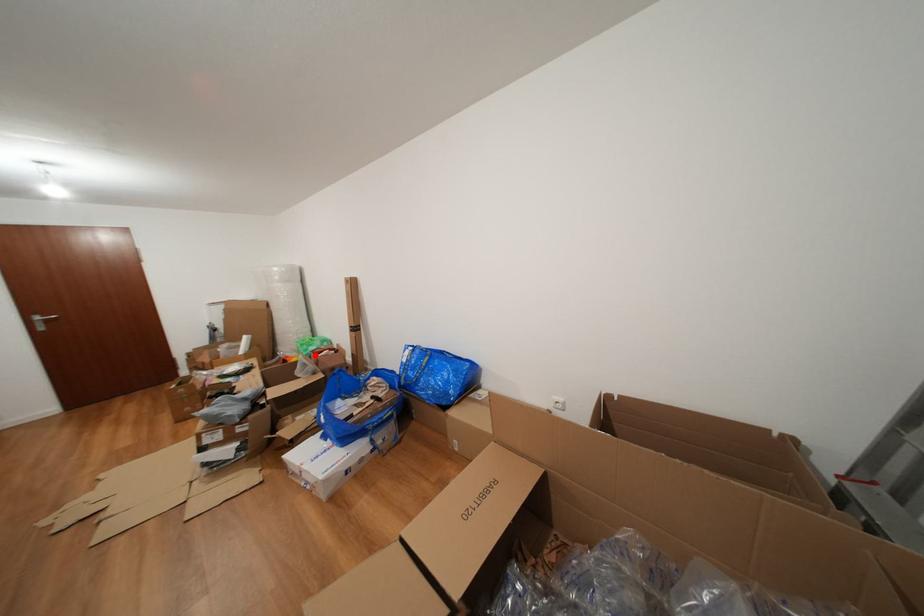
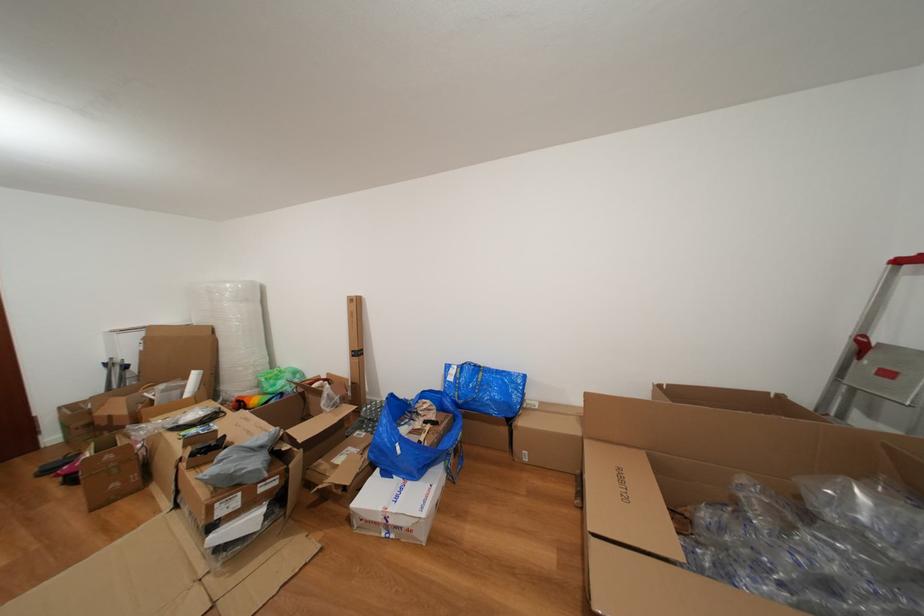
Find the pixel in the second image that matches the highlighted location in the first image.

(283, 390)